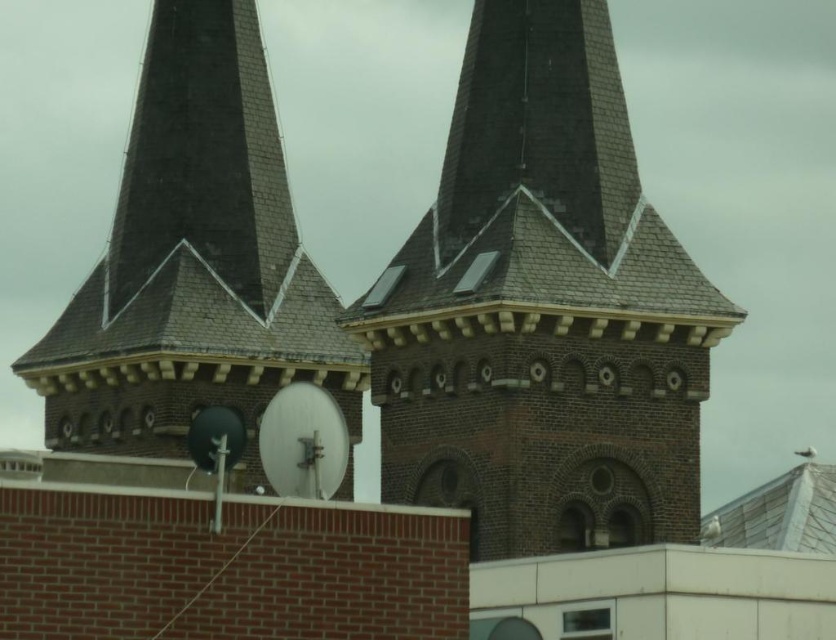
Question: Does brown brick tower at center appear over dark gray shingles at center?

Choices:
 (A) no
 (B) yes

Answer: (B)

Question: Can you confirm if brown brick tower at center is smaller than dark gray shingles at center?

Choices:
 (A) yes
 (B) no

Answer: (A)

Question: Which object appears farthest from the camera in this image?

Choices:
 (A) brown brick tower at center
 (B) dark gray shingles at center

Answer: (A)

Question: Is brown brick tower at center behind dark gray shingles at center?

Choices:
 (A) yes
 (B) no

Answer: (A)